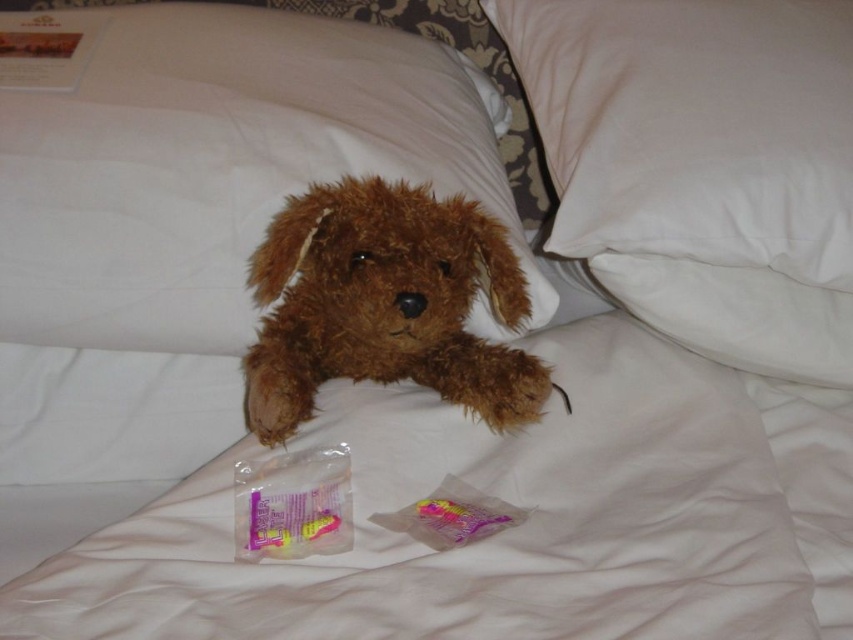
You are a delivery robot that needs to place a small package between the brown plush at upper center and the white cotton pillow at upper right. Can you fit the package there if it measures 12 inches in length?

The distance between the brown plush at upper center and the white cotton pillow at upper right is 13.94 inches. Since the package is 12 inches long, it can fit in the space between them.

You are a child who wants to place the brown plush toy at center on top of the white cotton pillow at upper right. Based on their sizes, will the toy fit without hanging off the edges?

The brown plush toy at center is taller than the white cotton pillow at upper right, so placing it on top would cause the toy to hang off the edges since it is larger in height.

You are standing in front of a bed with a plush toy dog lying on it. There are two small plastic packages in front of the dog. Can you determine if you can reach the point at coordinates point (x=303, y=99) without moving the packages?

The point at coordinates point (x=303, y=99) is 97.00 centimeters away from you, so you can reach it without moving the packages.